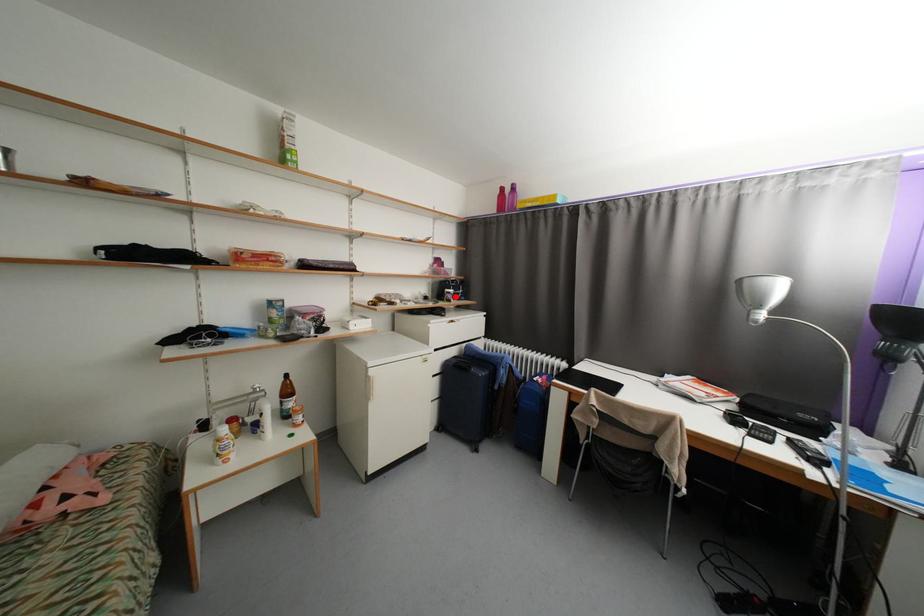
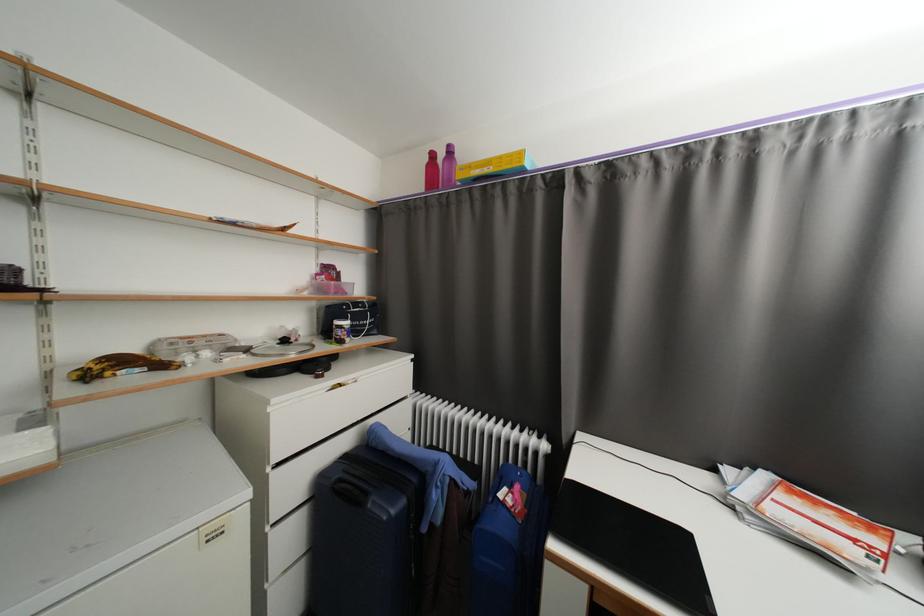
Question: I am providing you with two images of the same scene from different viewpoints. A red point is marked on the first image. Can you still see the location of the red point in image 2?

Choices:
 (A) Yes
 (B) No

Answer: (A)